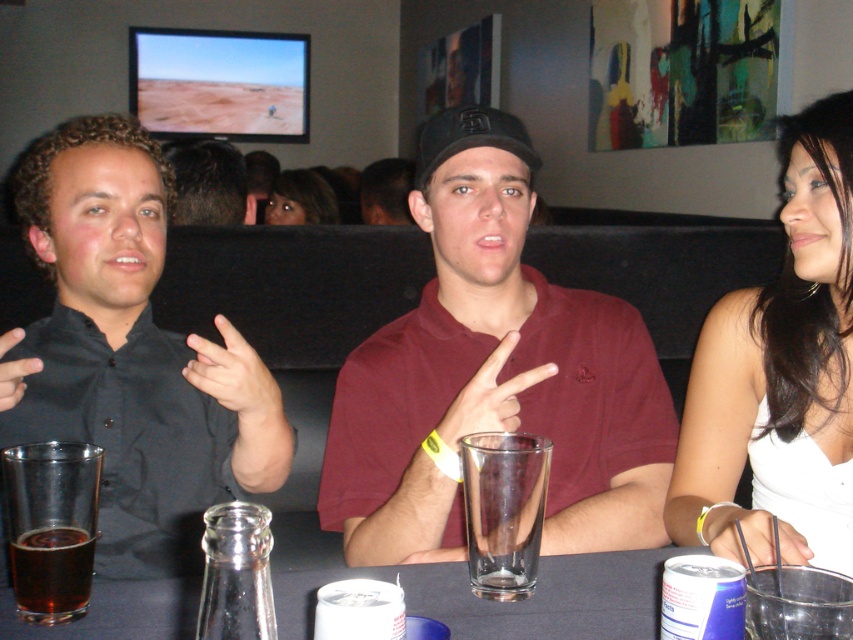
Question: Is dark amber glass at lower left behind dark brown hair at center?

Choices:
 (A) no
 (B) yes

Answer: (A)

Question: Which object is farther from the camera taking this photo?

Choices:
 (A) dark amber glass at lower left
 (B) dark amber liquid at lower left
 (C) maroon polo shirt at center

Answer: (C)

Question: Which of the following is the farthest from the observer?

Choices:
 (A) (587, 339)
 (B) (73, 580)
 (C) (227, 220)

Answer: (C)

Question: Does dark gray shirt at left appear on the left side of dark amber liquid at lower left?

Choices:
 (A) no
 (B) yes

Answer: (B)

Question: Does dark gray shirt at left appear on the left side of dark amber liquid at lower left?

Choices:
 (A) yes
 (B) no

Answer: (A)

Question: Which of these objects is positioned closest to the blonde hair at center?

Choices:
 (A) transparent glass at center
 (B) white satin dress at right

Answer: (B)